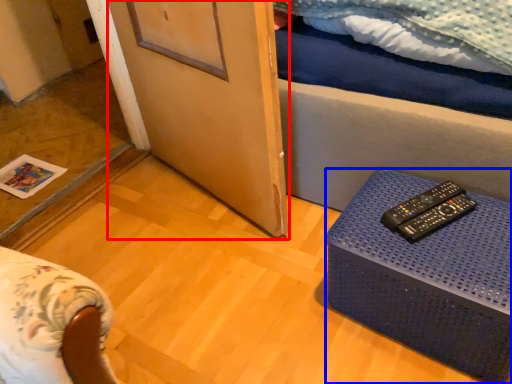
Question: Among these objects, which one is nearest to the camera, screen door (highlighted by a red box) or table (highlighted by a blue box)?

Choices:
 (A) screen door
 (B) table

Answer: (B)